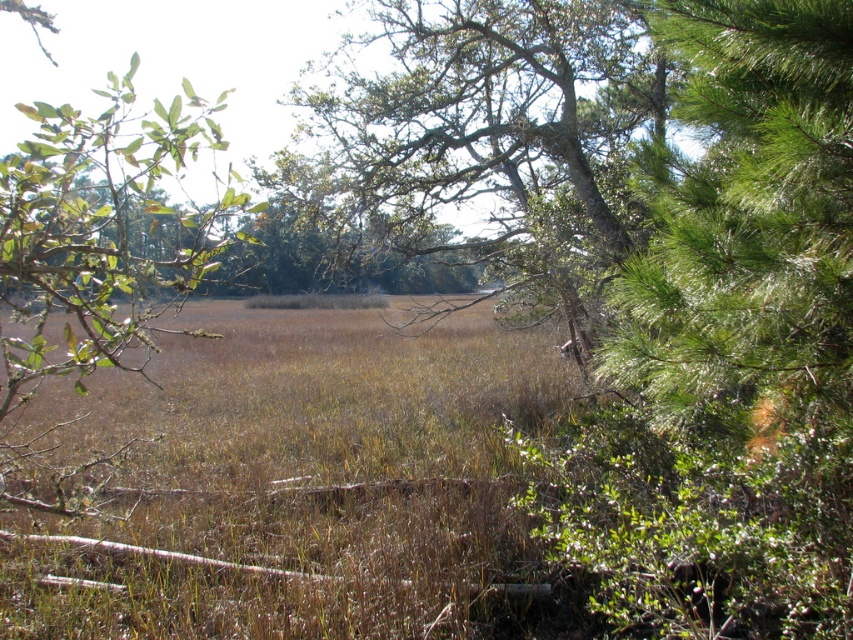
Question: Does green needle-like at right appear under green leafy tree at center?

Choices:
 (A) no
 (B) yes

Answer: (B)

Question: Considering the relative positions of green needle-like at right and green leafy tree at center in the image provided, where is green needle-like at right located with respect to green leafy tree at center?

Choices:
 (A) right
 (B) left

Answer: (A)

Question: Which of the following is the farthest from the observer?

Choices:
 (A) (393, 13)
 (B) (846, 205)

Answer: (A)

Question: Does green needle-like at right have a lesser width compared to green leafy tree at center?

Choices:
 (A) yes
 (B) no

Answer: (A)

Question: Which object is closer to the camera taking this photo?

Choices:
 (A) green leafy tree at center
 (B) green needle-like at right

Answer: (B)